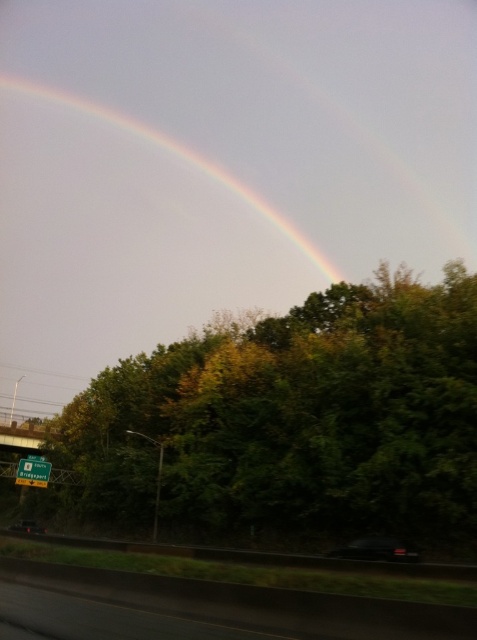
Question: Which point is closer to the camera?

Choices:
 (A) green leafy tree at upper center
 (B) shiny black car at lower center
 (C) black glossy car at lower center
 (D) green plastic sign at lower left

Answer: (B)

Question: Where is rainbow at upper center located in relation to black glossy car at lower center in the image?

Choices:
 (A) above
 (B) below

Answer: (A)

Question: Which object is positioned farthest from the black asphalt highway at lower center?

Choices:
 (A) green plastic sign at lower left
 (B) rainbow at upper center
 (C) shiny black car at lower center

Answer: (B)

Question: Considering the real-world distances, which object is closest to the black glossy car at lower center?

Choices:
 (A) green leafy tree at upper center
 (B) black asphalt highway at lower center
 (C) shiny black car at lower center

Answer: (A)

Question: Does rainbow at upper center lie in front of black glossy car at lower center?

Choices:
 (A) no
 (B) yes

Answer: (A)

Question: Does shiny black car at lower center appear over green plastic sign at lower left?

Choices:
 (A) no
 (B) yes

Answer: (B)